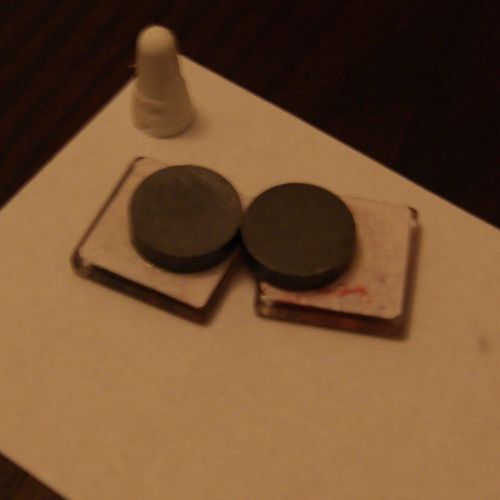
I want to click on white wall, so click(44, 431).